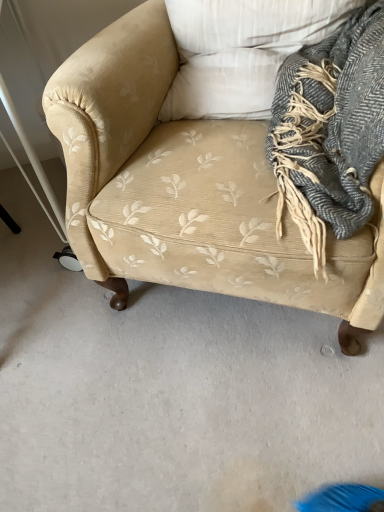
Question: Considering the relative sizes of beige corduroy couch at center and white textured pillow at upper center in the image provided, is beige corduroy couch at center thinner than white textured pillow at upper center?

Choices:
 (A) no
 (B) yes

Answer: (A)

Question: Is beige corduroy couch at center not close to white textured pillow at upper center?

Choices:
 (A) no
 (B) yes

Answer: (A)

Question: From a real-world perspective, is beige corduroy couch at center positioned under white textured pillow at upper center based on gravity?

Choices:
 (A) no
 (B) yes

Answer: (B)

Question: Is beige corduroy couch at center positioned in front of white textured pillow at upper center?

Choices:
 (A) no
 (B) yes

Answer: (B)

Question: Is beige corduroy couch at center touching white textured pillow at upper center?

Choices:
 (A) no
 (B) yes

Answer: (A)

Question: Does point (362, 261) appear closer or farther from the camera than point (205, 24)?

Choices:
 (A) farther
 (B) closer

Answer: (B)

Question: Is beige corduroy couch at center spatially inside white textured pillow at upper center, or outside of it?

Choices:
 (A) outside
 (B) inside

Answer: (A)

Question: In terms of width, does beige corduroy couch at center look wider or thinner when compared to white textured pillow at upper center?

Choices:
 (A) wide
 (B) thin

Answer: (A)

Question: In terms of height, does beige corduroy couch at center look taller or shorter compared to white textured pillow at upper center?

Choices:
 (A) tall
 (B) short

Answer: (A)

Question: Looking at the image, does gray wool scarf at upper right seem bigger or smaller compared to white textured pillow at upper center?

Choices:
 (A) small
 (B) big

Answer: (B)

Question: Considering the positions of gray wool scarf at upper right and white textured pillow at upper center in the image, is gray wool scarf at upper right wider or thinner than white textured pillow at upper center?

Choices:
 (A) thin
 (B) wide

Answer: (B)

Question: Considering the positions of point (306, 217) and point (205, 79), is point (306, 217) closer or farther from the camera than point (205, 79)?

Choices:
 (A) farther
 (B) closer

Answer: (B)

Question: From a real-world perspective, is gray wool scarf at upper right physically located above or below white textured pillow at upper center?

Choices:
 (A) below
 (B) above

Answer: (A)

Question: Looking at their shapes, would you say gray wool scarf at upper right is wider or thinner than beige corduroy couch at center?

Choices:
 (A) thin
 (B) wide

Answer: (A)

Question: Considering the positions of gray wool scarf at upper right and beige corduroy couch at center in the image, is gray wool scarf at upper right taller or shorter than beige corduroy couch at center?

Choices:
 (A) tall
 (B) short

Answer: (B)